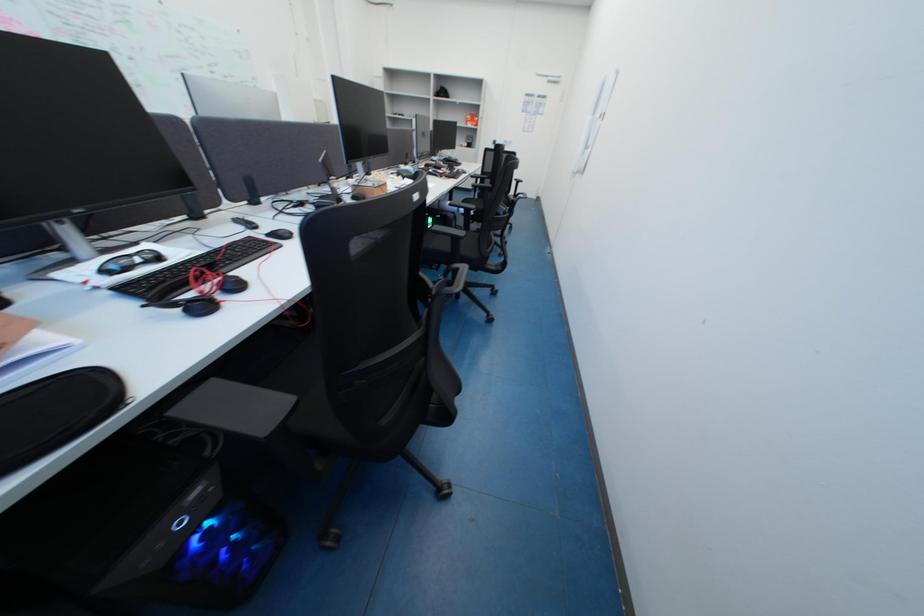
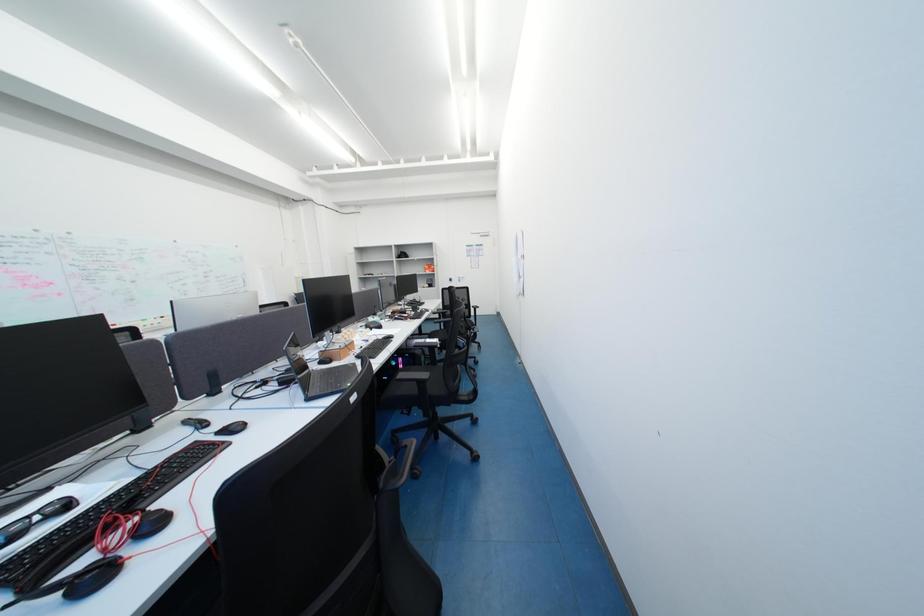
Which direction would the cameraman need to move to produce the second image?

The cameraman walked toward right, backward.